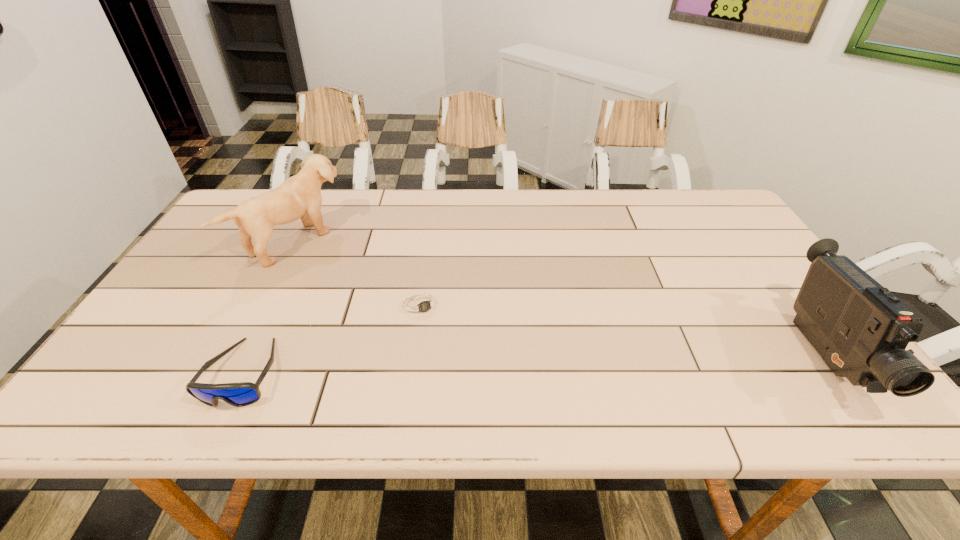
Locate an element on the screen. empty space that is in between the puppy and the sunglasses is located at coordinates (271, 306).

Locate an element on the screen. unoccupied position between the camcorder and the third tallest object is located at coordinates (534, 364).

The width and height of the screenshot is (960, 540). I want to click on free space between the puppy and the sunglasses, so click(271, 306).

Point out which object is positioned as the nearest to the shortest object. Please provide its 2D coordinates. Your answer should be formatted as a tuple, i.e. [(x, y)], where the tuple contains the x and y coordinates of a point satisfying the conditions above.

[(299, 196)]

Locate an element on the screen. The width and height of the screenshot is (960, 540). the third closest object to the farthest object is located at coordinates (861, 330).